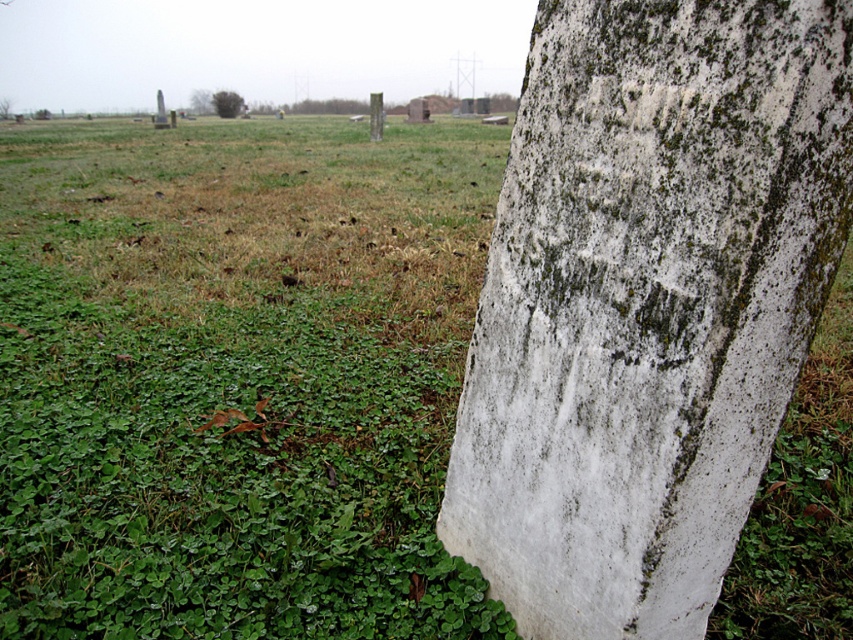
Which is below, white weathered stone at center or green mossy tree at upper left?

Positioned lower is white weathered stone at center.

The image size is (853, 640). What do you see at coordinates (647, 301) in the screenshot?
I see `white weathered stone at center` at bounding box center [647, 301].

Is point (631, 374) positioned behind point (229, 93)?

No, (631, 374) is closer to viewer.

Identify the location of white weathered stone at center. (647, 301).